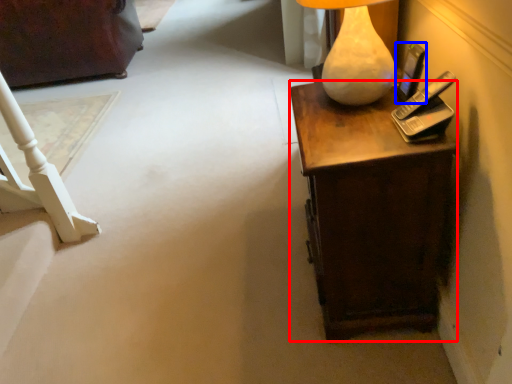
Question: Which object is closer to the camera taking this photo, desk (highlighted by a red box) or mobile phone (highlighted by a blue box)?

Choices:
 (A) desk
 (B) mobile phone

Answer: (A)